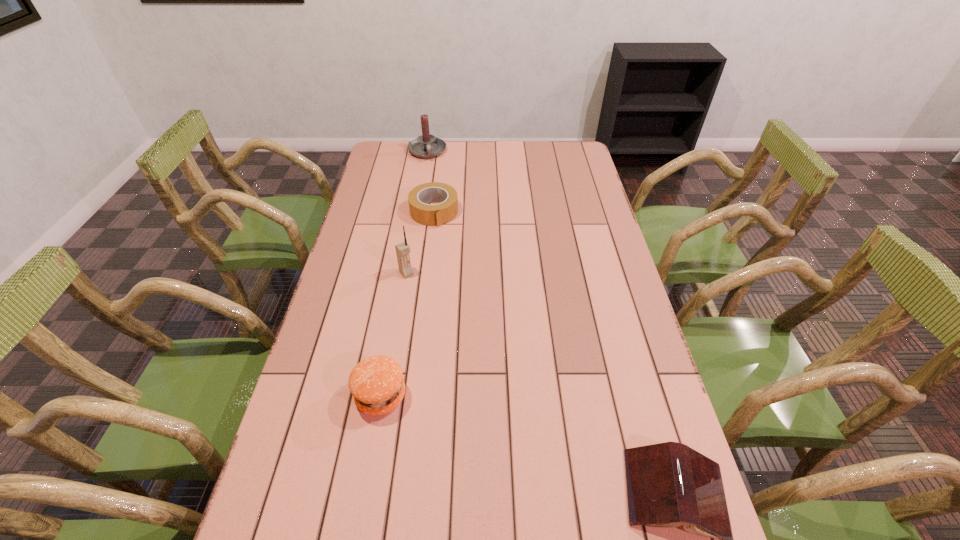
Where is `free location that satisfies the following two spatial constraints: 1. on the back side of the second nearest object; 2. on the right side of the third nearest object`? The height and width of the screenshot is (540, 960). free location that satisfies the following two spatial constraints: 1. on the back side of the second nearest object; 2. on the right side of the third nearest object is located at coordinates (402, 273).